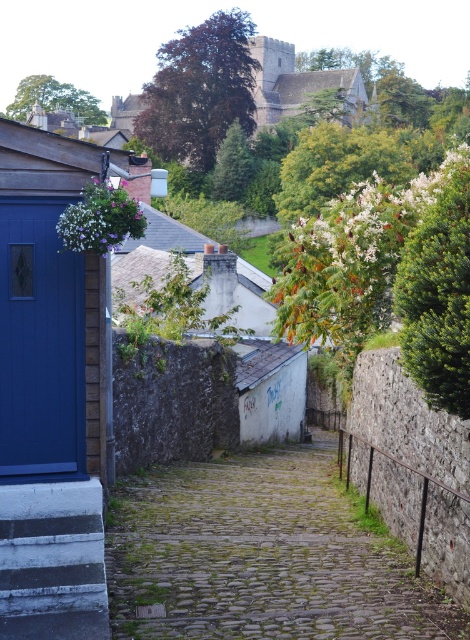
Question: Which point appears farthest from the camera in this image?

Choices:
 (A) (47, 552)
 (B) (39, 432)

Answer: (B)

Question: Can you confirm if matte blue door at left is positioned below white painted wood stairs at lower left?

Choices:
 (A) yes
 (B) no

Answer: (B)

Question: Can you confirm if cobblestone path at center is thinner than white painted wood stairs at lower left?

Choices:
 (A) no
 (B) yes

Answer: (A)

Question: Which point is farther from the camera taking this photo?

Choices:
 (A) (14, 508)
 (B) (242, 573)
 (C) (24, 353)

Answer: (C)

Question: Is cobblestone path at center bigger than matte blue door at left?

Choices:
 (A) yes
 (B) no

Answer: (A)

Question: Estimate the real-world distances between objects in this image. Which object is closer to the white painted wood stairs at lower left?

Choices:
 (A) cobblestone path at center
 (B) matte blue door at left

Answer: (B)